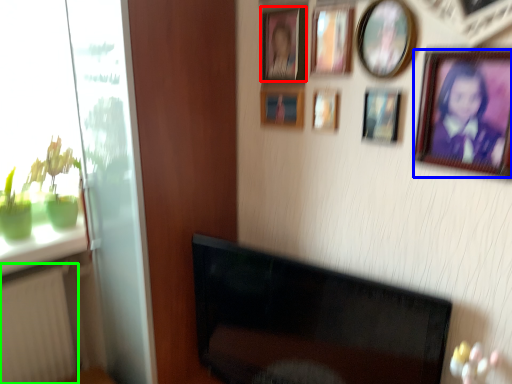
Question: Estimate the real-world distances between objects in this image. Which object is farther from picture frame (highlighted by a red box), picture frame (highlighted by a blue box) or radiator (highlighted by a green box)?

Choices:
 (A) picture frame
 (B) radiator

Answer: (B)